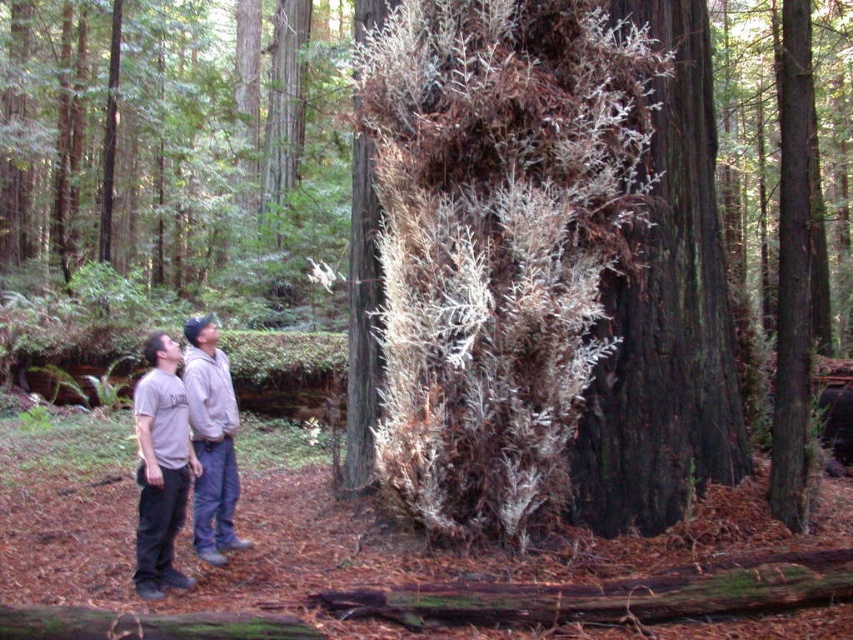
You are standing in the forest and see the point at coordinates (171, 460). Which object is that point located on?

The point at coordinates (171, 460) is located on the gray cotton t shirt at lower left.